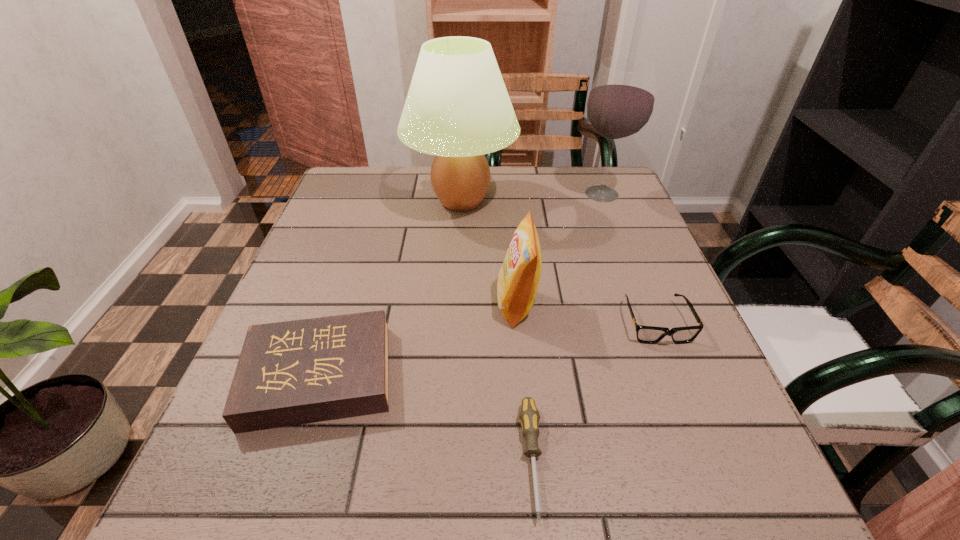
Find the location of a particular element. The width and height of the screenshot is (960, 540). vacant area located on the front-facing side of the crisp (potato chip) is located at coordinates (322, 305).

Where is `free space located on the back of the hardback book`? free space located on the back of the hardback book is located at coordinates (371, 217).

Identify the location of vacant region located on the front-facing side of the sunglasses. (696, 421).

The image size is (960, 540). Identify the location of lampshade located in the far edge section of the desktop. (457, 108).

Locate an element on the screen. This screenshot has width=960, height=540. alcohol at the far edge is located at coordinates (620, 104).

Find the location of a particular element. Image resolution: width=960 pixels, height=540 pixels. object located in the near edge section of the desktop is located at coordinates (529, 416).

This screenshot has height=540, width=960. What are the coordinates of `object located at the left edge` in the screenshot? It's located at (296, 372).

The height and width of the screenshot is (540, 960). Identify the location of alcohol that is at the right edge. (620, 104).

Identify the location of sunglasses situated at the right edge. The image size is (960, 540). (645, 334).

You are a GUI agent. You are given a task and a screenshot of the screen. Output one action in this format:
    pyautogui.click(x=<x>, y=<y>)
    Task: Click on the object at the far right corner
    This screenshot has height=540, width=960.
    Given the screenshot: What is the action you would take?
    pyautogui.click(x=620, y=104)